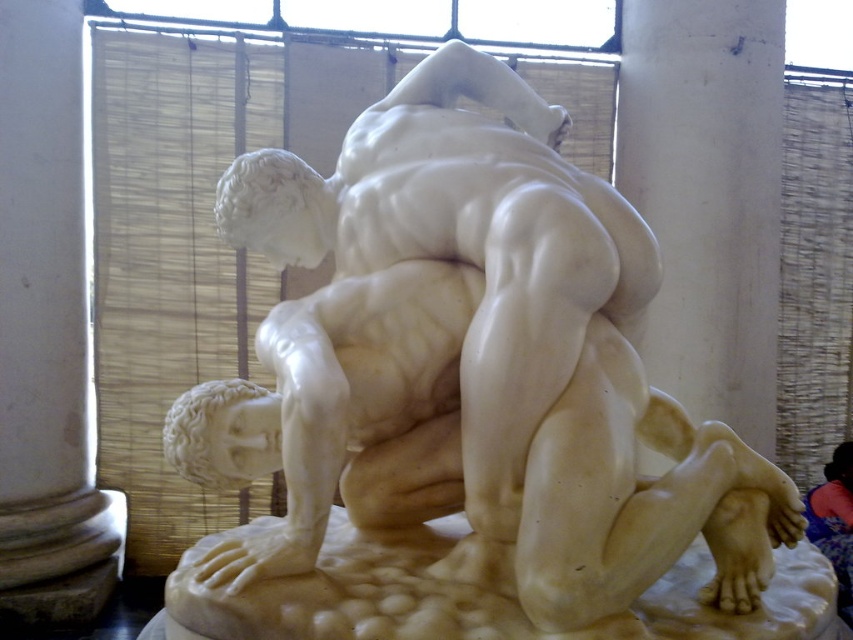
You are an art conservator examining the sculpture. You need to place a protective barrier around the white marble pillar at left and the white marble at center. Which object requires a wider barrier to accommodate its size?

The white marble at center requires a wider barrier because it has a greater width than the white marble pillar at left.

You are a photographer setting up a shoot in a gallery. You need to position a light source to highlight the white marble statue at center without casting a shadow from the white marble pillar at left. Where should you place the light source relative to the statue and pillar?

The white marble statue at center is positioned under the white marble pillar at left. To avoid casting a shadow from the pillar, the light source should be placed in a position where the pillar does not block the light path to the statue. Since the statue is under the pillar, placing the light source above and behind the pillar would ensure light reaches the statue without obstruction from the pillar.

You are an art conservator examining the sculpture and need to place a protective barrier around it. The barrier must be positioned such that it does not block the light coming through the window. Given the white marble pillar at left is at coordinates point 0.517, 0.055, where should the barrier be placed relative to the pillar to ensure adequate lighting?

The white marble pillar at left is located at point (45, 330). To ensure the barrier does not block the light from the window, it should be placed away from the pillar on the side opposite the window, allowing the light to pass through unobstructed.